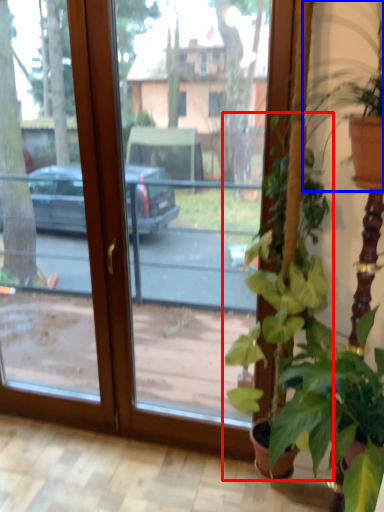
Question: Which point is further to the camera, houseplant (highlighted by a red box) or houseplant (highlighted by a blue box)?

Choices:
 (A) houseplant
 (B) houseplant

Answer: (A)